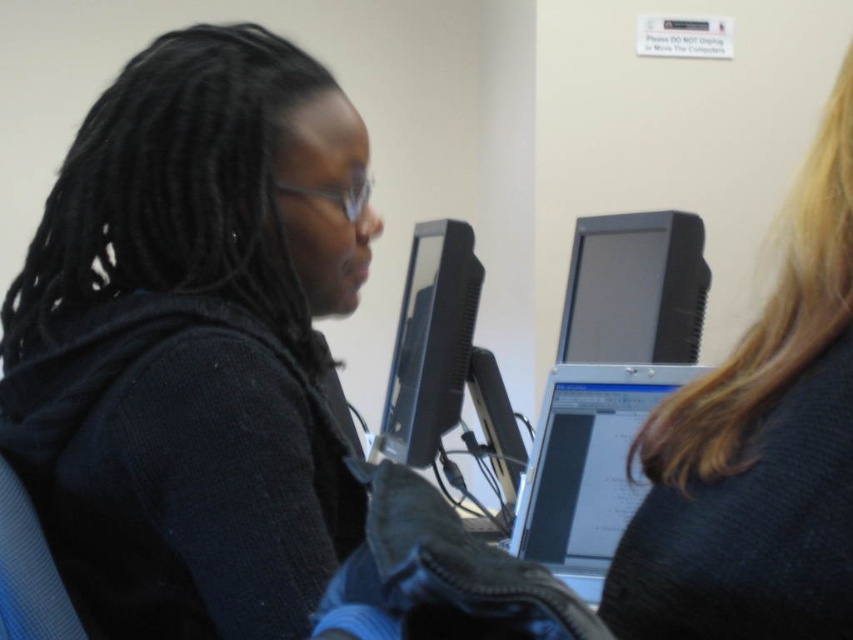
Question: Does silver metallic laptop at center have a lesser width compared to matte black monitor at center?

Choices:
 (A) yes
 (B) no

Answer: (B)

Question: Which point appears farthest from the camera in this image?

Choices:
 (A) (619, 240)
 (B) (283, 115)
 (C) (631, 380)
 (D) (440, 243)

Answer: (A)

Question: Estimate the real-world distances between objects in this image. Which object is farther from the matte black monitor at upper center?

Choices:
 (A) silver metallic laptop at center
 (B) black matte jacket at left

Answer: (B)

Question: Does blonde hair at upper right have a smaller size compared to matte black monitor at center?

Choices:
 (A) no
 (B) yes

Answer: (B)

Question: In this image, where is blonde hair at upper right located relative to matte black monitor at center?

Choices:
 (A) below
 (B) above

Answer: (B)

Question: Which of the following is the closest to the observer?

Choices:
 (A) silver metallic laptop at center
 (B) matte black monitor at upper center
 (C) matte black monitor at center
 (D) black matte jacket at left

Answer: (D)